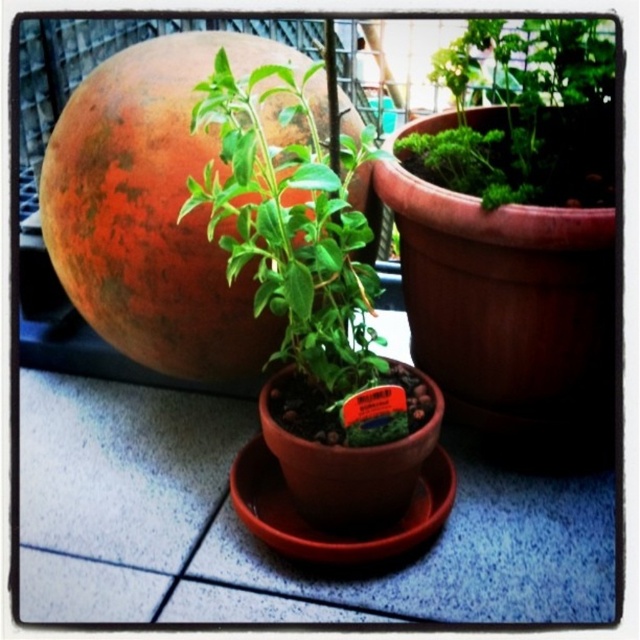
Does matte orange sphere at upper left appear over green leafy plant at center?

Actually, matte orange sphere at upper left is below green leafy plant at center.

Can you confirm if matte orange sphere at upper left is taller than green leafy plant at center?

Correct, matte orange sphere at upper left is much taller as green leafy plant at center.

Does point (100, 186) lie behind point (577, 36)?

No, it is in front of (577, 36).

Locate an element on the screen. The width and height of the screenshot is (640, 640). matte orange sphere at upper left is located at coordinates (154, 211).